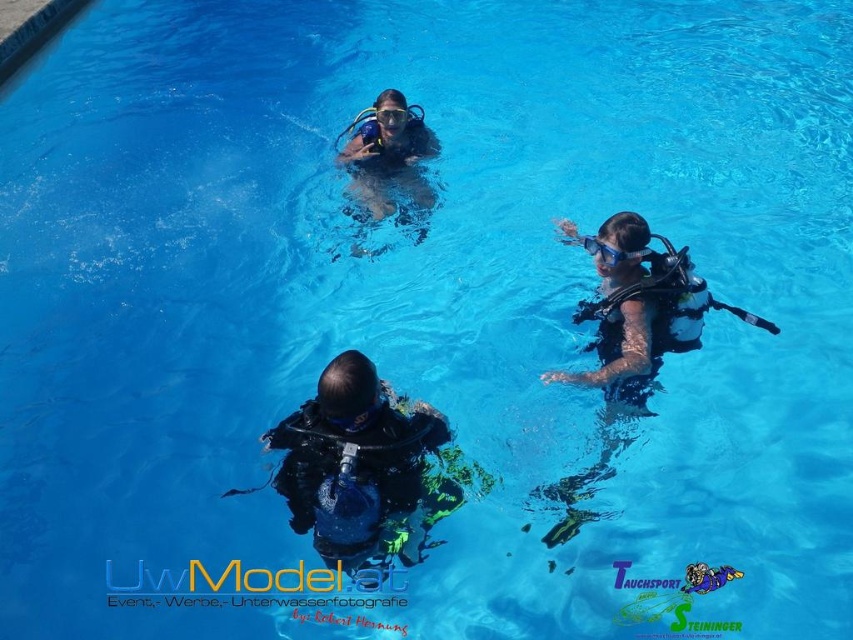
Can you confirm if matte black scuba gear at upper center is positioned to the left of transparent rubber goggles at upper center?

Yes, matte black scuba gear at upper center is to the left of transparent rubber goggles at upper center.

Who is positioned more to the left, matte black scuba gear at upper center or transparent rubber goggles at upper center?

From the viewer's perspective, matte black scuba gear at upper center appears more on the left side.

This screenshot has height=640, width=853. What do you see at coordinates (387, 156) in the screenshot?
I see `matte black scuba gear at upper center` at bounding box center [387, 156].

Locate an element on the screen. matte black scuba gear at upper center is located at coordinates (387, 156).

Is black matte scuba gear at center shorter than transparent rubber goggles at upper center?

In fact, black matte scuba gear at center may be taller than transparent rubber goggles at upper center.

Is point (387, 397) closer to viewer compared to point (635, 259)?

Yes, point (387, 397) is closer to viewer.

Describe the element at coordinates (354, 464) in the screenshot. I see `black matte scuba gear at center` at that location.

Where is `black matte scuba gear at center`? This screenshot has height=640, width=853. black matte scuba gear at center is located at coordinates click(x=354, y=464).

Which is in front, point (363, 497) or point (357, 252)?

Point (363, 497)

How distant is black matte scuba gear at center from matte black scuba gear at upper center?

5.24 meters

Image resolution: width=853 pixels, height=640 pixels. Identify the location of black matte scuba gear at center. (354, 464).